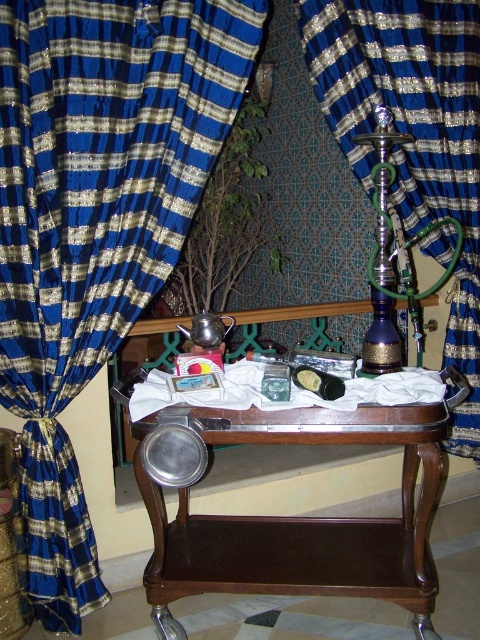
Question: Estimate the real-world distances between objects in this image. Which object is closer to the blue silk curtain at left?

Choices:
 (A) brown wood table at center
 (B) blue silk curtain at center

Answer: (A)

Question: Is blue silk curtain at left to the left of brown wood table at center from the viewer's perspective?

Choices:
 (A) no
 (B) yes

Answer: (B)

Question: From the image, what is the correct spatial relationship of blue silk curtain at left in relation to brown wood table at center?

Choices:
 (A) right
 (B) left

Answer: (B)

Question: Is brown wood table at center to the right of blue silk curtain at center from the viewer's perspective?

Choices:
 (A) no
 (B) yes

Answer: (A)

Question: Which of the following is the closest to the observer?

Choices:
 (A) brown wood table at center
 (B) blue silk curtain at center
 (C) blue silk curtain at left

Answer: (A)

Question: Which object is the closest to the brown wood table at center?

Choices:
 (A) blue silk curtain at left
 (B) blue silk curtain at center

Answer: (A)